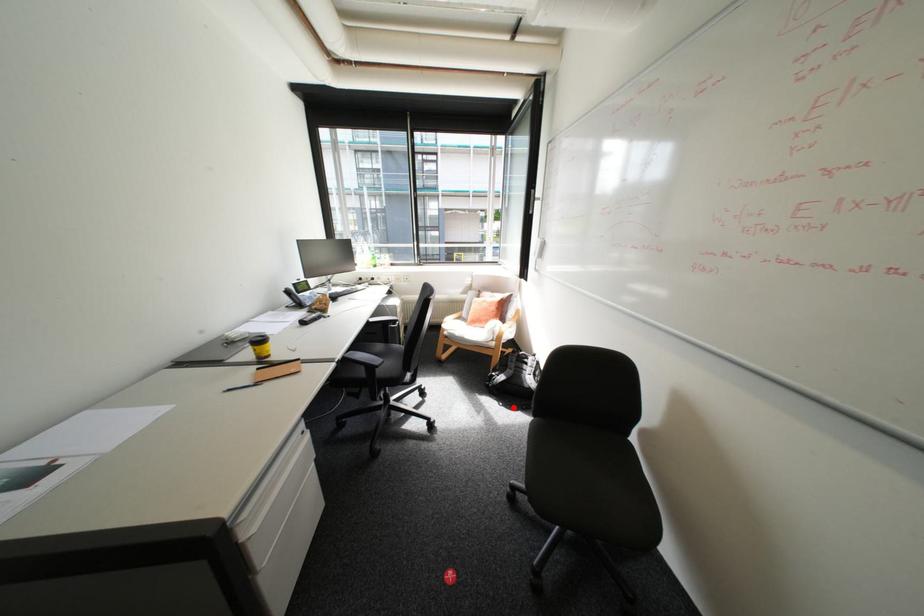
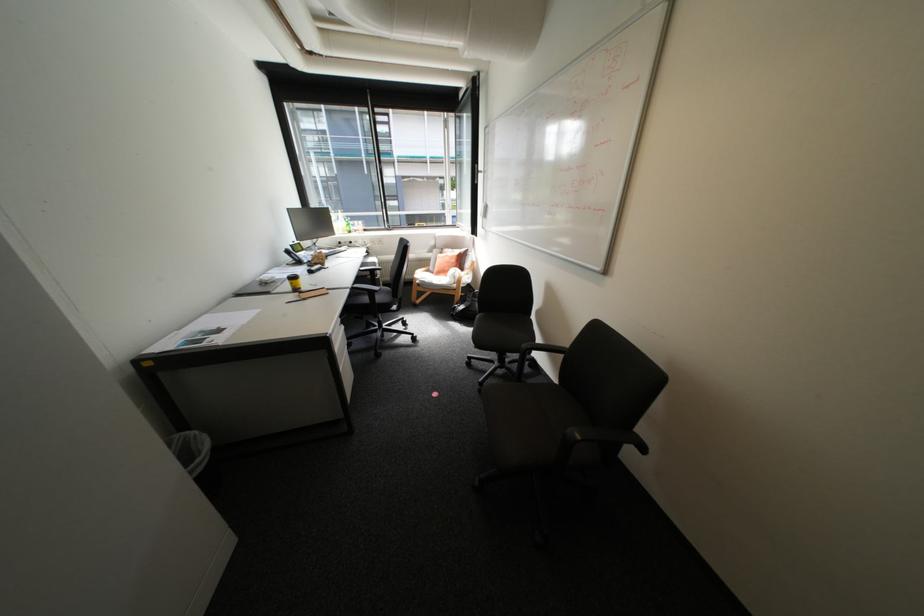
Question: I am providing you with two images of the same scene from different viewpoints. In image1, a red point is highlighted. Considering the same 3D point in image2, which of the following is correct?

Choices:
 (A) It is closer
 (B) It is farther

Answer: (B)